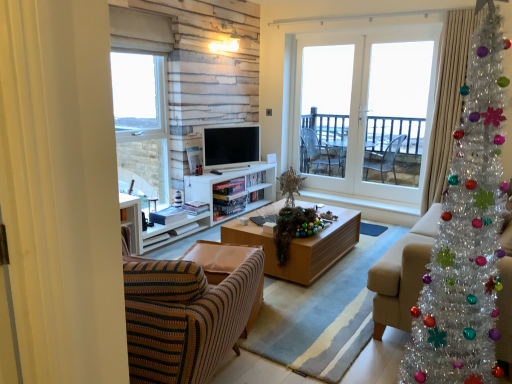
Question: Does white glass screen door at center, arranged as the 2th screen door when viewed from the left, have a lesser height compared to shiny tinsel garland at center?

Choices:
 (A) yes
 (B) no

Answer: (B)

Question: Is shiny tinsel garland at center completely or partially inside white glass screen door at center, which is the first screen door in right-to-left order?

Choices:
 (A) no
 (B) yes

Answer: (A)

Question: Is white glass screen door at center, arranged as the 2th screen door when viewed from the left, to the right of shiny tinsel garland at center from the viewer's perspective?

Choices:
 (A) yes
 (B) no

Answer: (A)

Question: Is white glass screen door at center, arranged as the 2th screen door when viewed from the left, bigger than shiny tinsel garland at center?

Choices:
 (A) yes
 (B) no

Answer: (A)

Question: Is white glass screen door at center, which is the first screen door in right-to-left order, in front of shiny tinsel garland at center?

Choices:
 (A) yes
 (B) no

Answer: (B)

Question: Is point (416, 261) closer or farther from the camera than point (311, 87)?

Choices:
 (A) closer
 (B) farther

Answer: (A)

Question: Considering the positions of beige fabric couch at right and clear glass door at center, the first screen door positioned from the left, in the image, is beige fabric couch at right bigger or smaller than clear glass door at center, the first screen door positioned from the left,?

Choices:
 (A) big
 (B) small

Answer: (A)

Question: From a real-world perspective, is beige fabric couch at right above or below clear glass door at center, the 2th screen door when ordered from right to left?

Choices:
 (A) above
 (B) below

Answer: (B)

Question: From the image's perspective, is beige fabric couch at right positioned above or below clear glass door at center, the first screen door positioned from the left?

Choices:
 (A) below
 (B) above

Answer: (A)

Question: Considering their positions, is clear glass window at upper left, the 1th window in the left-to-right sequence, located in front of or behind beige fabric couch at right?

Choices:
 (A) front
 (B) behind

Answer: (B)

Question: From a real-world perspective, is clear glass window at upper left, which is counted as the second window, starting from the right, above or below beige fabric couch at right?

Choices:
 (A) above
 (B) below

Answer: (A)

Question: From the image's perspective, is clear glass window at upper left, which is counted as the second window, starting from the right, positioned above or below beige fabric couch at right?

Choices:
 (A) below
 (B) above

Answer: (B)

Question: Looking at the image, does clear glass window at upper left, the 1th window in the left-to-right sequence, seem bigger or smaller compared to beige fabric couch at right?

Choices:
 (A) big
 (B) small

Answer: (B)

Question: In terms of width, does clear glass window at upper left, which is counted as the second window, starting from the right, look wider or thinner when compared to white glass door at center, which is counted as the 1th window, starting from the right?

Choices:
 (A) wide
 (B) thin

Answer: (A)

Question: From a real-world perspective, is clear glass window at upper left, which is counted as the second window, starting from the right, positioned above or below white glass door at center, arranged as the second window when viewed from the left?

Choices:
 (A) below
 (B) above

Answer: (A)